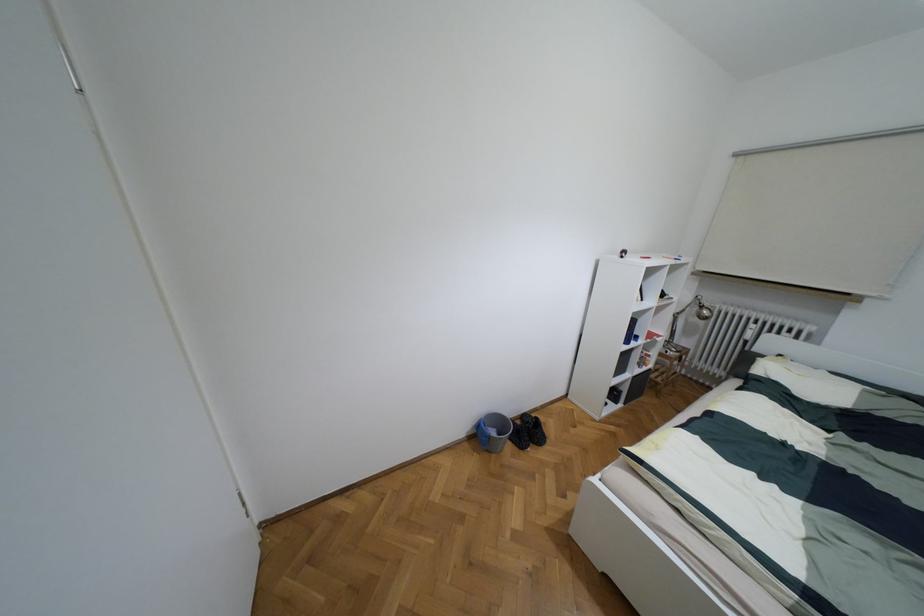
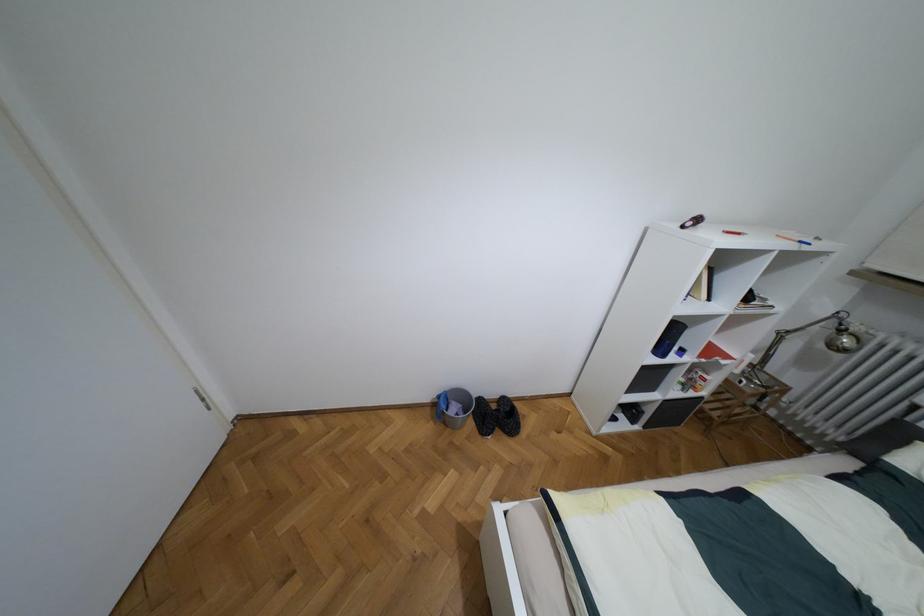
Question: The camera is either moving clockwise (left) or counter-clockwise (right) around the object. The first image is from the beginning of the video and the second image is from the end. Is the camera moving left or right when shooting the video?

Choices:
 (A) Left
 (B) Right

Answer: (B)